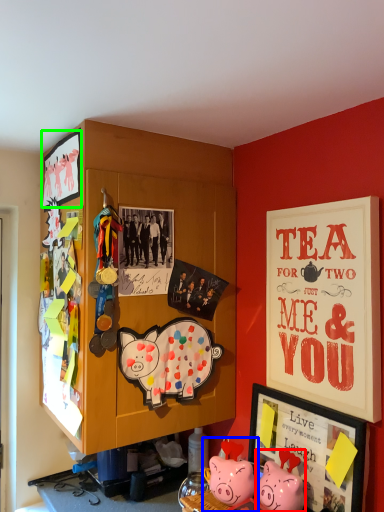
Question: Considering the real-world distances, which object is closest to toy (highlighted by a red box)? toy (highlighted by a blue box) or picture frame (highlighted by a green box).

Choices:
 (A) toy
 (B) picture frame

Answer: (A)